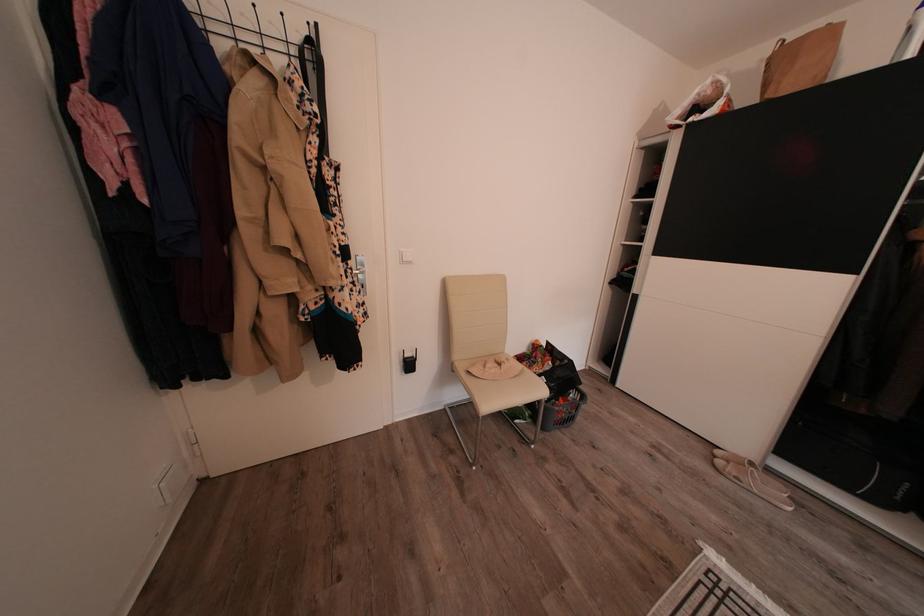
I want to click on silver door handle, so click(x=361, y=268).